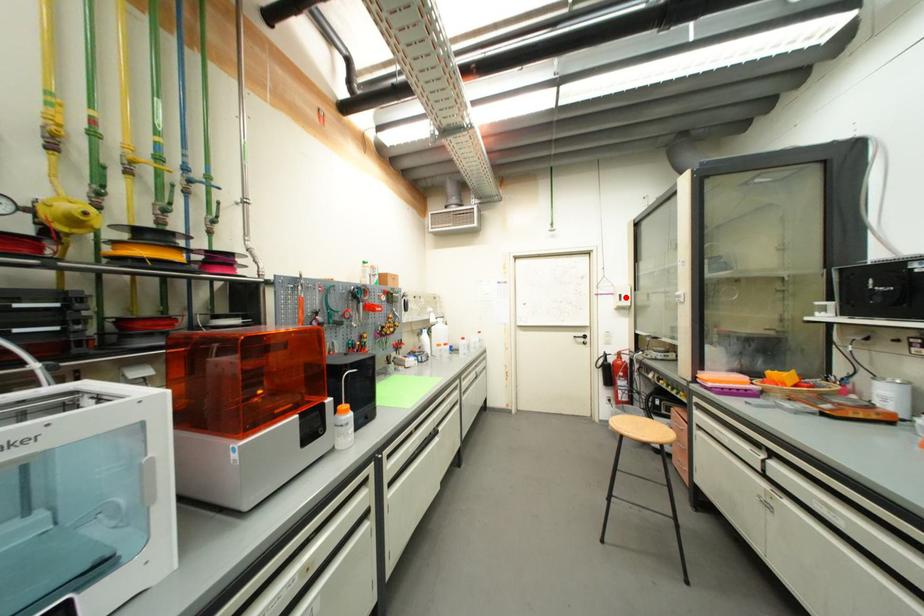
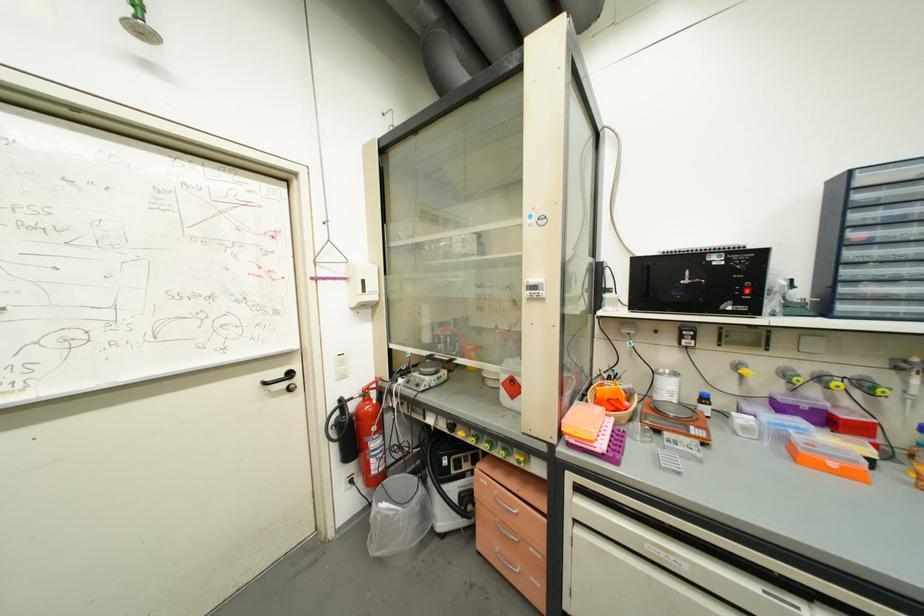
The point at the highlighted location is marked in the first image. Where is the corresponding point in the second image?

(369, 283)